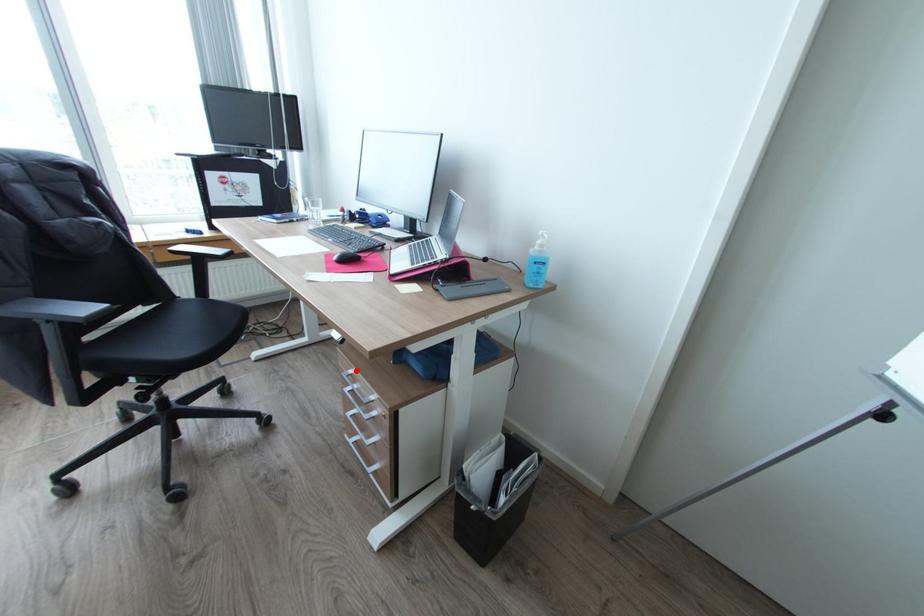
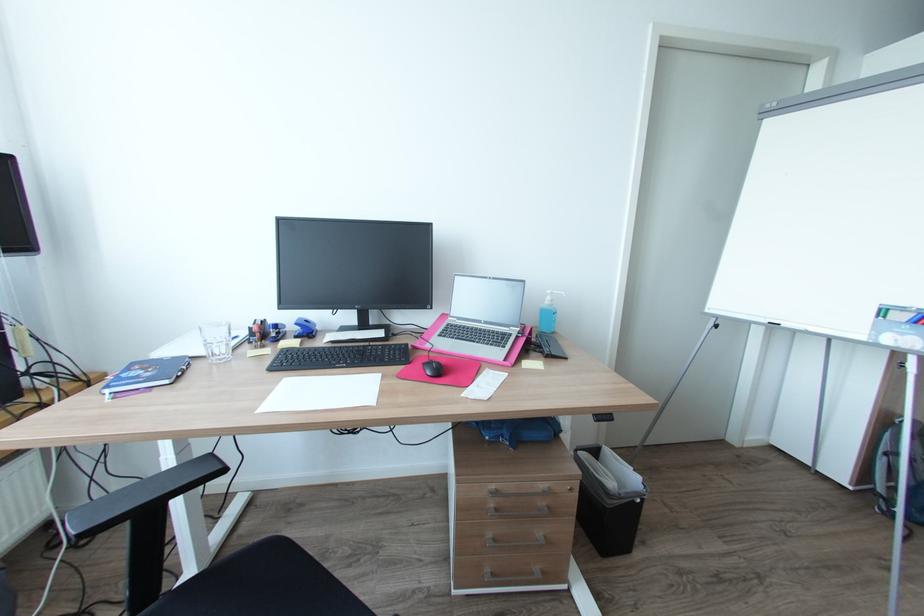
Question: I am providing you with two images of the same scene from different viewpoints. In image1, a red point is highlighted. Considering the same 3D point in image2, which of the following is correct?

Choices:
 (A) It is closer
 (B) It is farther

Answer: (A)